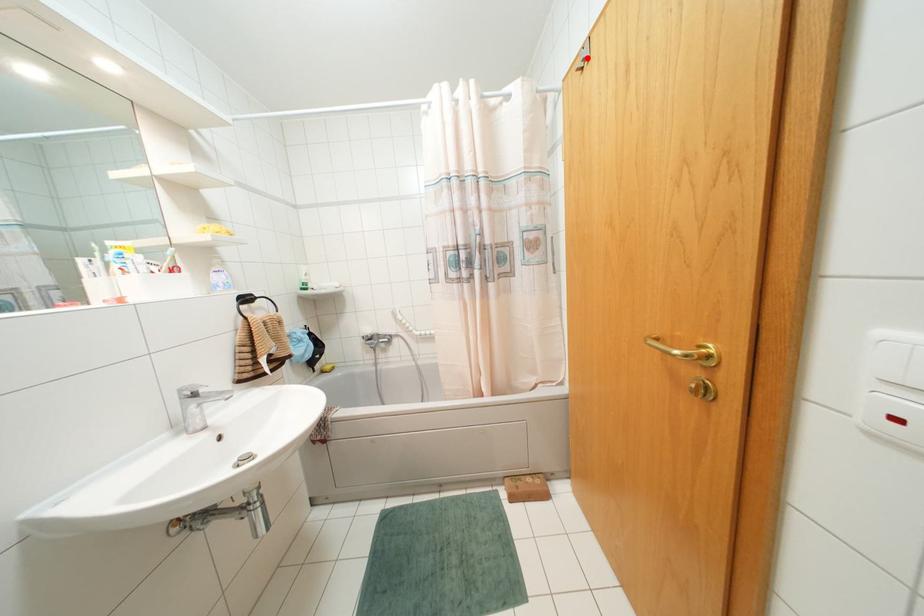
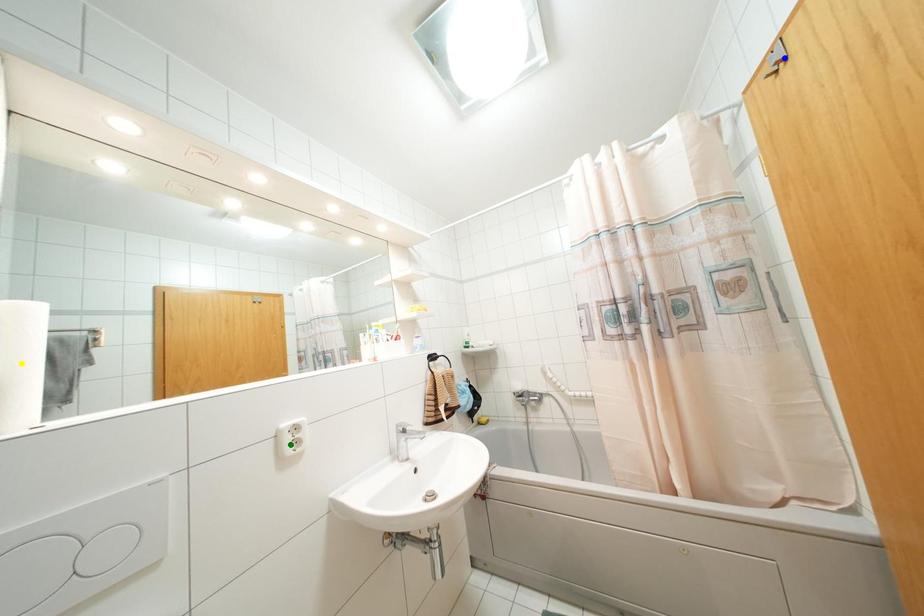
Question: I am providing you with two images of the same scene from different viewpoints. A red point is marked on the first image. You are given multiple points on the second image. In image 2, which mark is for the same physical point as the one in image 1?

Choices:
 (A) blue point
 (B) yellow point
 (C) green point

Answer: (A)